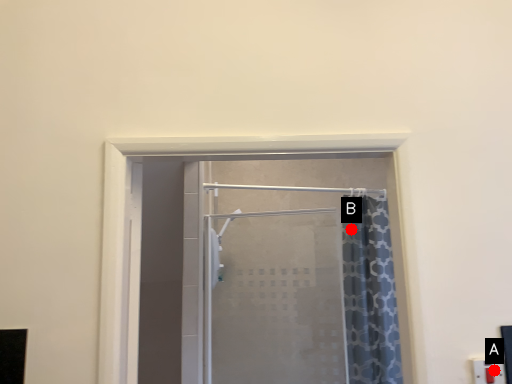
Question: Two points are circled on the image, labeled by A and B beside each circle. Among these points, which one is nearest to the camera?

Choices:
 (A) A is closer
 (B) B is closer

Answer: (A)